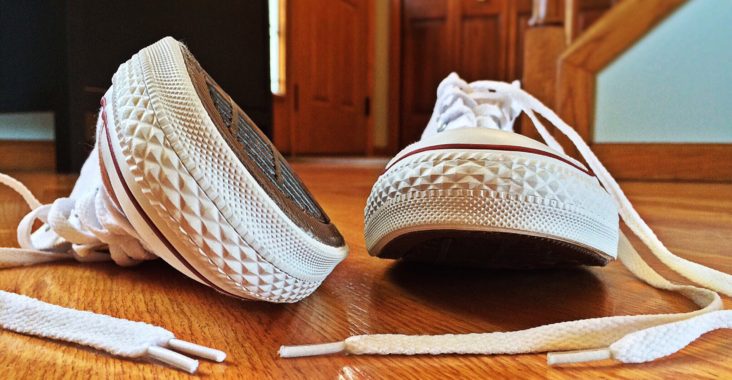
Where is `stairs`? stairs is located at coordinates (623, 27).